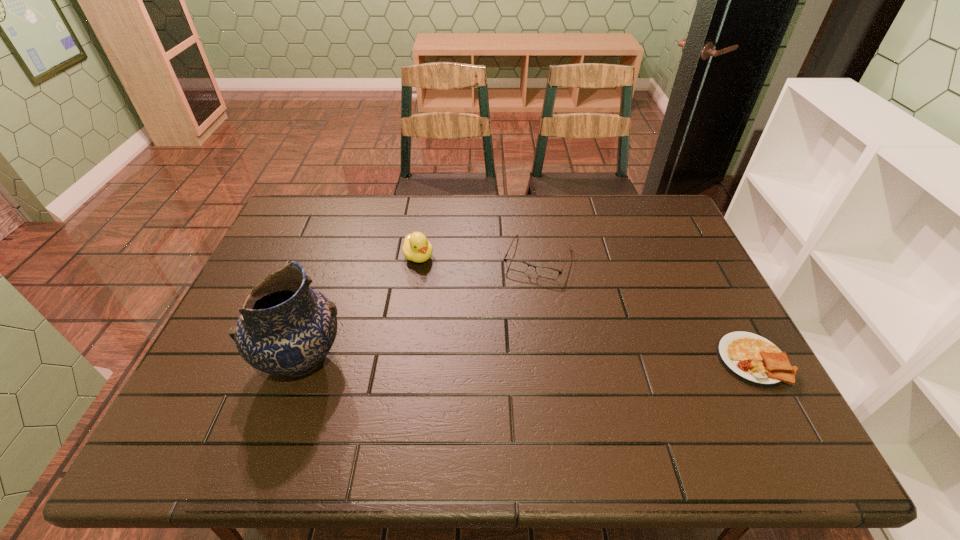
Identify the location of pottery. (285, 328).

You are a GUI agent. You are given a task and a screenshot of the screen. Output one action in this format:
    pyautogui.click(x=<x>, y=<y>)
    Task: Click on the leftmost object
    
    Given the screenshot: What is the action you would take?
    (285, 328)

Where is `the shortest object`? the shortest object is located at coordinates (751, 358).

Locate an element on the screen. Image resolution: width=960 pixels, height=540 pixels. the rightmost object is located at coordinates (751, 358).

Where is `duckling`? duckling is located at coordinates (416, 247).

The width and height of the screenshot is (960, 540). I want to click on the third object from right to left, so click(x=416, y=247).

The height and width of the screenshot is (540, 960). Find the location of `spectacles`. spectacles is located at coordinates (513, 264).

Where is `the third tallest object`? This screenshot has height=540, width=960. the third tallest object is located at coordinates (513, 264).

This screenshot has width=960, height=540. Find the location of `vacant space situated on the right of the tallest object`. vacant space situated on the right of the tallest object is located at coordinates point(501,360).

Where is `free point located 0.070m on the left of the shortest object`? The height and width of the screenshot is (540, 960). free point located 0.070m on the left of the shortest object is located at coordinates (690, 360).